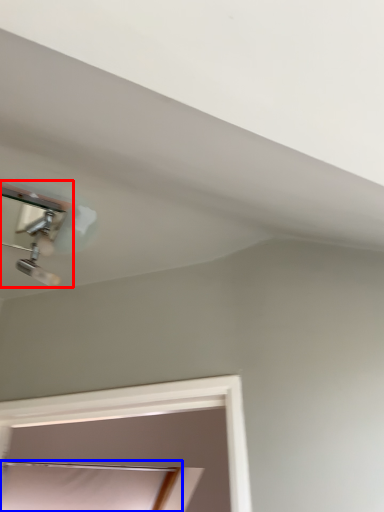
Question: Among these objects, which one is nearest to the camera, lamp (highlighted by a red box) or window (highlighted by a blue box)?

Choices:
 (A) lamp
 (B) window

Answer: (A)